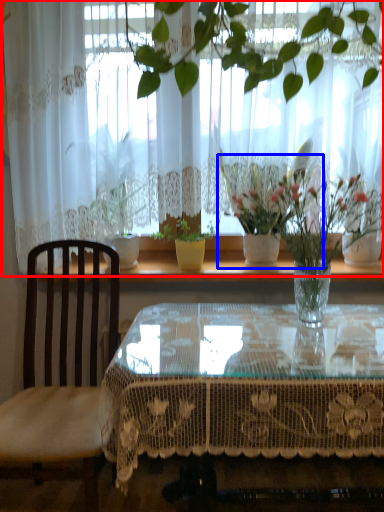
Question: Which object is closer to the camera taking this photo, curtain (highlighted by a red box) or houseplant (highlighted by a blue box)?

Choices:
 (A) curtain
 (B) houseplant

Answer: (A)